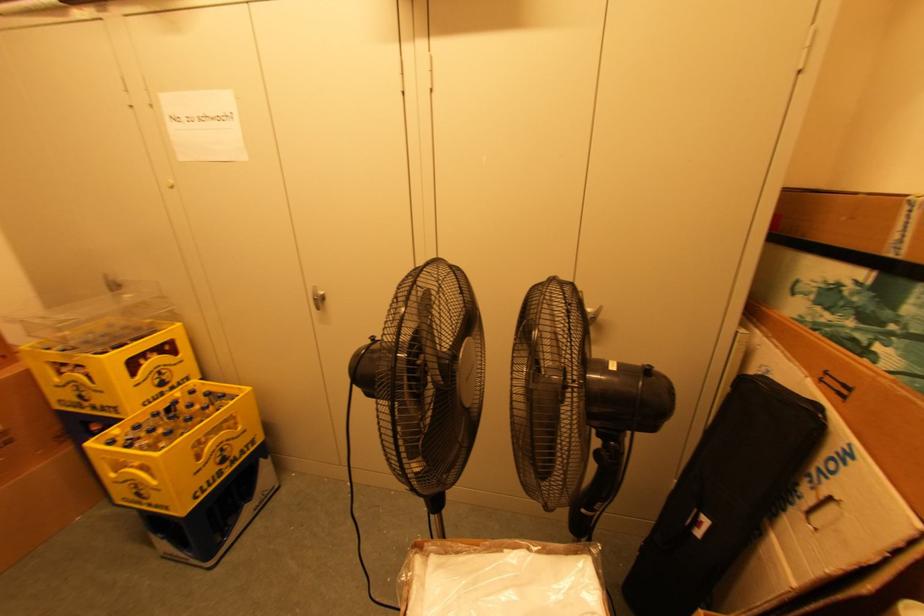
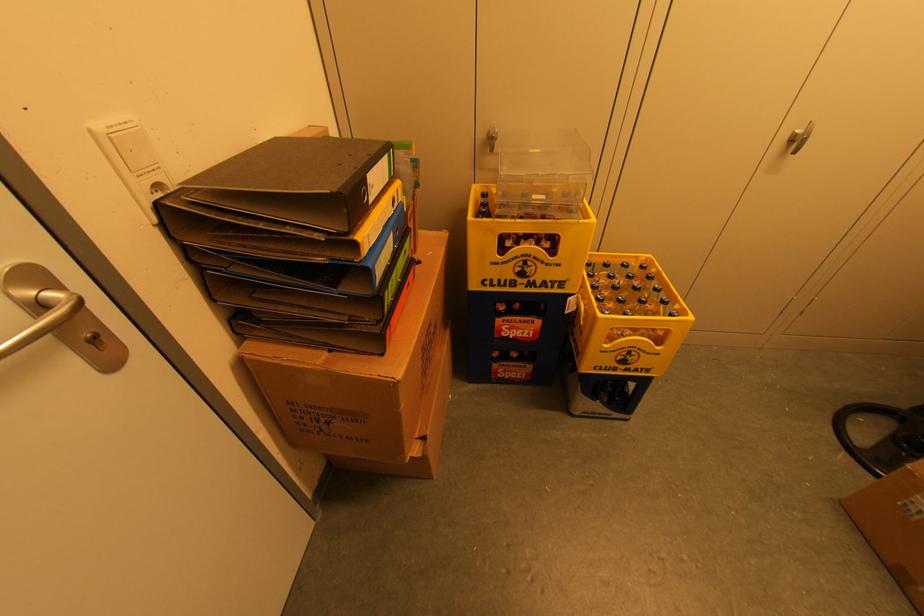
Find the pixel in the second image that matches the point at 87,394 in the first image.

(530, 270)